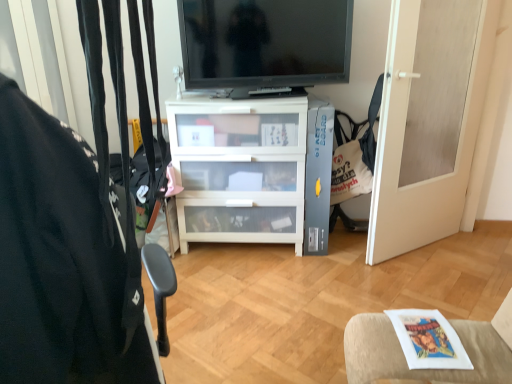
Question: From a real-world perspective, is black fabric chair at left physically located above or below black glossy tv at upper center?

Choices:
 (A) below
 (B) above

Answer: (A)

Question: Considering the positions of black fabric chair at left and black glossy tv at upper center in the image, is black fabric chair at left taller or shorter than black glossy tv at upper center?

Choices:
 (A) short
 (B) tall

Answer: (B)

Question: Based on their relative distances, which object is nearer to the black glossy tv at upper center?

Choices:
 (A) white matte door at right
 (B) white fabric cushion at lower right
 (C) white fabric bag at right
 (D) black fabric chair at left

Answer: (C)

Question: Which is farther from the black fabric chair at left?

Choices:
 (A) white fabric bag at right
 (B) white matte door at right
 (C) black glossy tv at upper center
 (D) white fabric cushion at lower right

Answer: (B)